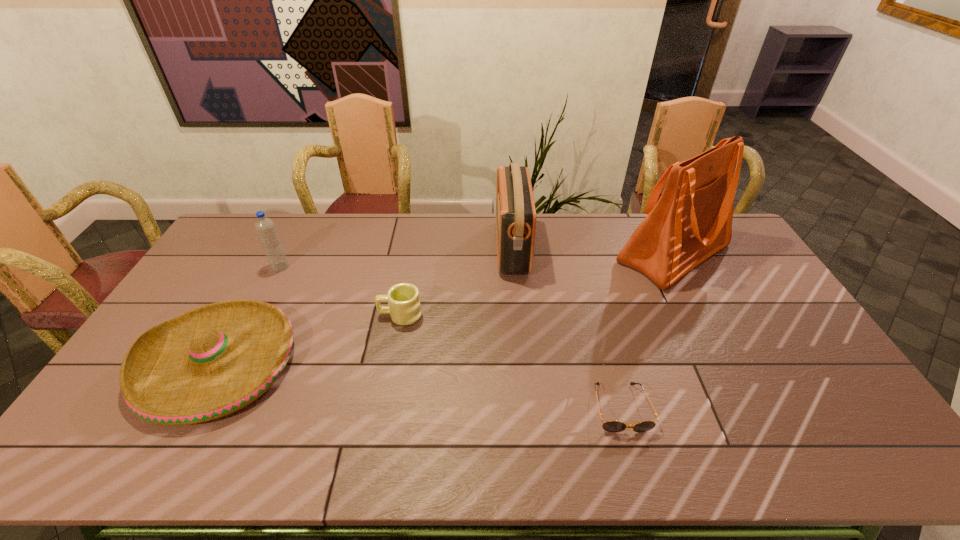
Identify which object is the second nearest to the tallest object. Please provide its 2D coordinates. Your answer should be formatted as a tuple, i.e. [(x, y)], where the tuple contains the x and y coordinates of a point satisfying the conditions above.

[(611, 426)]

Locate which object ranks fifth in proximity to the shortest object. Please provide its 2D coordinates. Your answer should be formatted as a tuple, i.e. [(x, y)], where the tuple contains the x and y coordinates of a point satisfying the conditions above.

[(265, 227)]

The height and width of the screenshot is (540, 960). I want to click on vacant space that satisfies the following two spatial constraints: 1. on the front-facing side of the shopping bag; 2. on the left side of the fourth object from left to right, so click(513, 253).

Locate an element on the screen. free point that satisfies the following two spatial constraints: 1. with the handle on the side of the fourth object from right to left; 2. on the front side of the third shortest object is located at coordinates (391, 362).